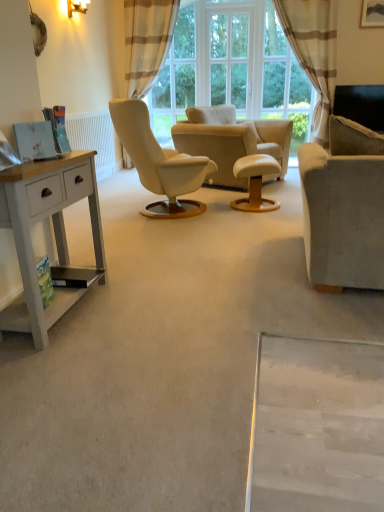
Question: In terms of size, does light gray fabric couch at right appear bigger or smaller than beige striped curtain at upper center?

Choices:
 (A) big
 (B) small

Answer: (A)

Question: From a real-world perspective, is light gray fabric couch at right positioned above or below beige striped curtain at upper center?

Choices:
 (A) above
 (B) below

Answer: (B)

Question: Estimate the real-world distances between objects in this image. Which object is closer to the white painted radiator at left?

Choices:
 (A) beige fabric armchair at center
 (B) white leather ottoman at center
 (C) clear glass window at center
 (D) wooden picture frame at upper right
 (E) light gray fabric couch at right

Answer: (A)

Question: Which object is the farthest from the clear glass window at center?

Choices:
 (A) wooden picture frame at upper right
 (B) white painted radiator at left
 (C) white painted wood desk at left
 (D) beige striped curtain at upper center
 (E) light gray fabric couch at right

Answer: (C)